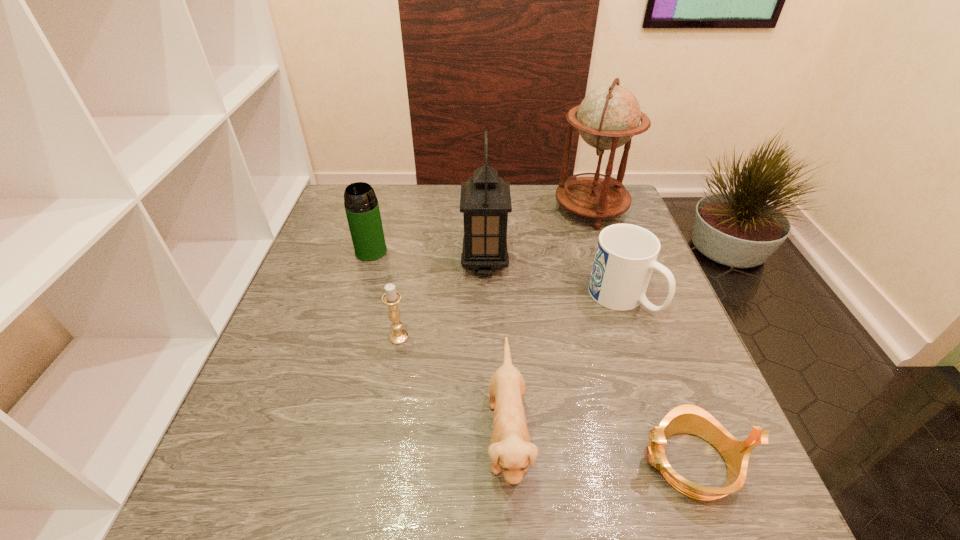
The height and width of the screenshot is (540, 960). Identify the location of free space between the farthest object and the shortest object. (640, 336).

Locate an element on the screen. The width and height of the screenshot is (960, 540). vacant area between the lantern and the farthest object is located at coordinates (538, 237).

Identify the location of free space that is in between the third nearest object and the puppy. This screenshot has width=960, height=540. click(x=453, y=387).

Image resolution: width=960 pixels, height=540 pixels. I want to click on unoccupied position between the lantern and the farthest object, so click(538, 237).

Where is `free space between the fifth shortest object and the lantern`? This screenshot has height=540, width=960. free space between the fifth shortest object and the lantern is located at coordinates (428, 258).

The height and width of the screenshot is (540, 960). What are the coordinates of `vacant space in between the puppy and the shortest object` in the screenshot? It's located at (599, 449).

I want to click on object that is the fifth closest to the tiara, so click(x=608, y=117).

You are a GUI agent. You are given a task and a screenshot of the screen. Output one action in this format:
    pyautogui.click(x=<x>, y=<y>)
    Task: Click on the object that is the second nearest to the lantern
    This screenshot has height=540, width=960.
    Given the screenshot: What is the action you would take?
    pyautogui.click(x=626, y=254)

Image resolution: width=960 pixels, height=540 pixels. Find the location of `free space that satisfies the following two spatial constraints: 1. on the surface of the farthest object; 2. from the spout of the leftmost object`. free space that satisfies the following two spatial constraints: 1. on the surface of the farthest object; 2. from the spout of the leftmost object is located at coordinates (605, 252).

In order to click on blank space that satisfies the following two spatial constraints: 1. on the back side of the mug; 2. on the left side of the candle holder in this screenshot , I will do `click(406, 298)`.